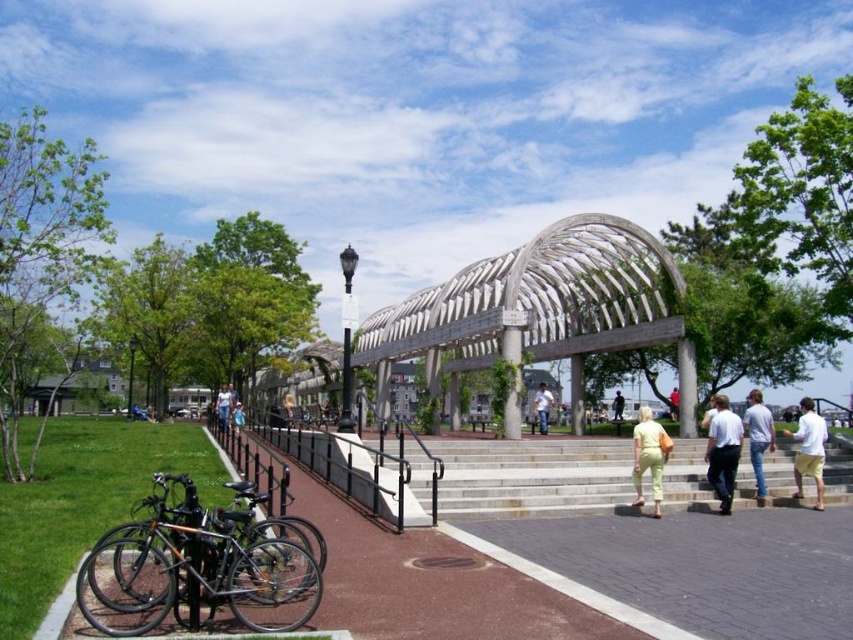
You are a photographer planning to capture a group photo of the lime green jumpsuit at center and the light yellow pants at center. Which person should you position closer to the camera to ensure both appear equally sized in the photo?

The lime green jumpsuit at center should be positioned closer to the camera because its width is less than the light yellow pants at center, so moving it forward will make them appear similar in size.